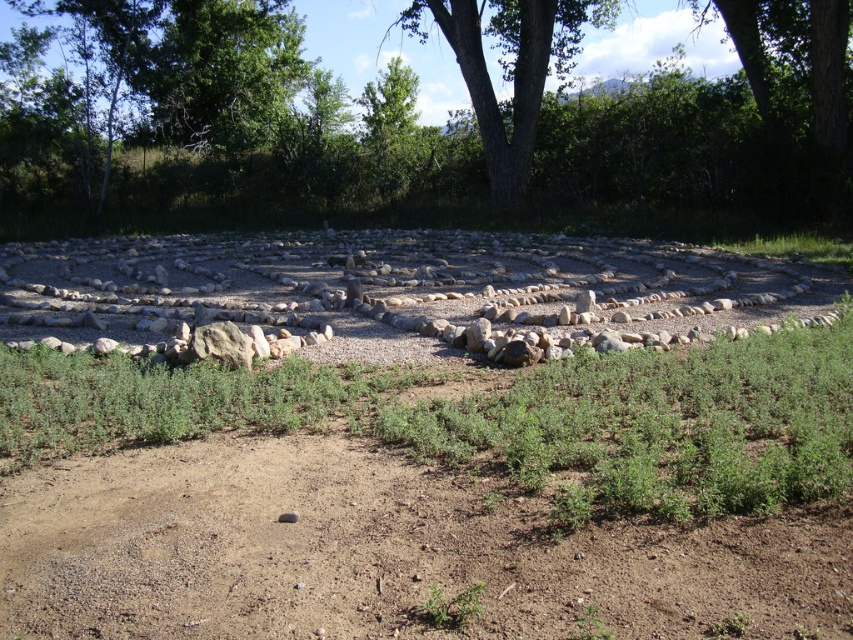
Question: Does green leafy tree at center appear under green rough bark tree at upper center?

Choices:
 (A) yes
 (B) no

Answer: (A)

Question: Is green leafy tree at center closer to camera compared to green rough bark tree at upper center?

Choices:
 (A) yes
 (B) no

Answer: (A)

Question: Which object is closer to the camera taking this photo?

Choices:
 (A) green leafy tree at center
 (B) green rough bark tree at upper center

Answer: (A)

Question: Which object appears closest to the camera in this image?

Choices:
 (A) green leafy tree at center
 (B) green rough bark tree at upper center

Answer: (A)

Question: Is green leafy tree at center in front of green rough bark tree at upper center?

Choices:
 (A) no
 (B) yes

Answer: (B)